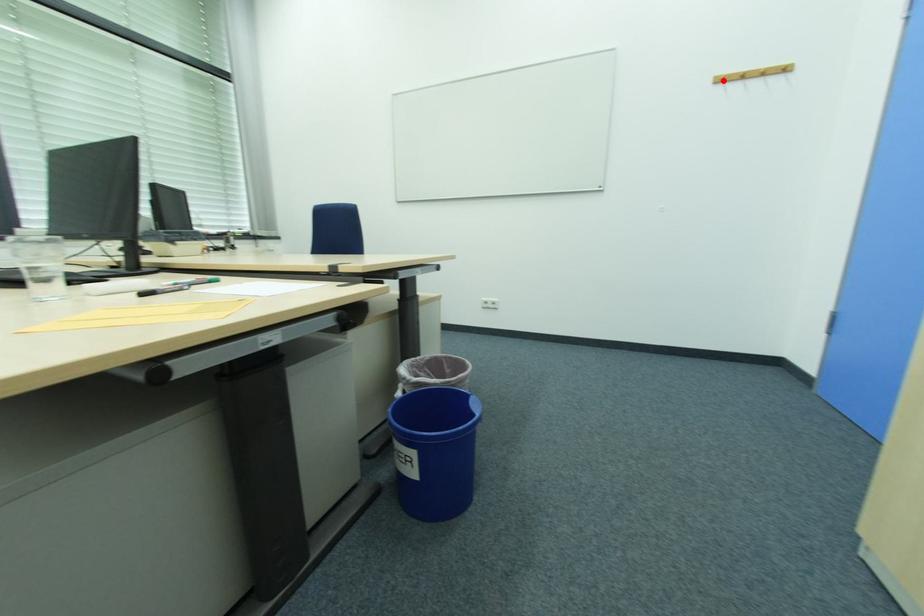
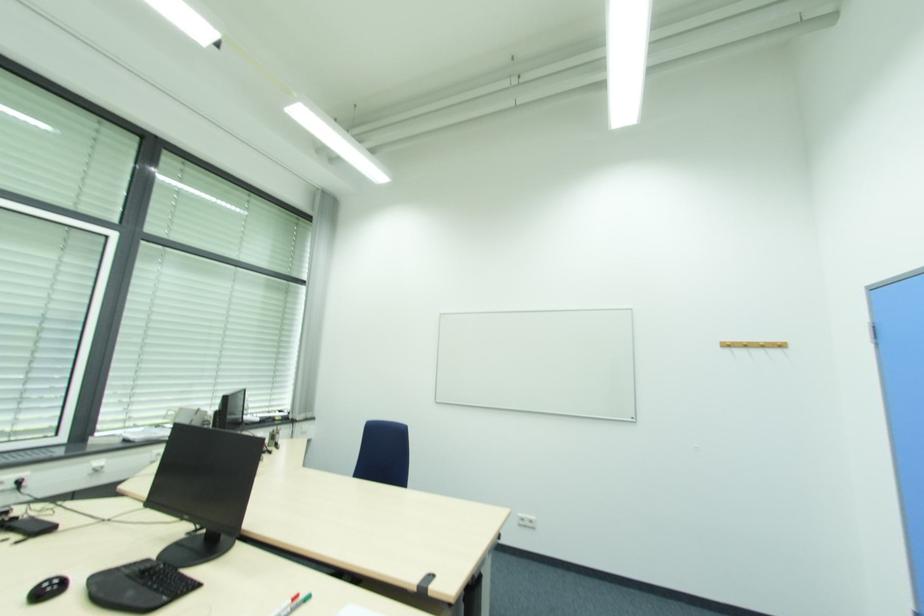
Where in the second image is the point corresponding to the highlighted location from the first image?

(730, 346)